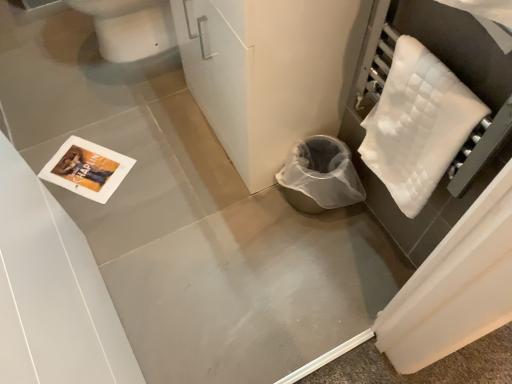
Question: From the image's perspective, is white glossy toilet bowl at upper left on top of white quilted towel at right?

Choices:
 (A) yes
 (B) no

Answer: (A)

Question: Does white glossy toilet bowl at upper left have a lesser height compared to white quilted towel at right?

Choices:
 (A) yes
 (B) no

Answer: (B)

Question: Can you confirm if white glossy toilet bowl at upper left is positioned to the left of white quilted towel at right?

Choices:
 (A) no
 (B) yes

Answer: (B)

Question: From a real-world perspective, is white glossy toilet bowl at upper left physically below white quilted towel at right?

Choices:
 (A) no
 (B) yes

Answer: (B)

Question: Is white glossy toilet bowl at upper left turned away from white quilted towel at right?

Choices:
 (A) no
 (B) yes

Answer: (A)

Question: Is white glossy toilet bowl at upper left outside of white quilted towel at right?

Choices:
 (A) yes
 (B) no

Answer: (A)

Question: Could you tell me if white quilted towel at right is facing white glossy toilet bowl at upper left?

Choices:
 (A) yes
 (B) no

Answer: (B)

Question: From the image's perspective, is white quilted towel at right on white glossy toilet bowl at upper left?

Choices:
 (A) no
 (B) yes

Answer: (A)

Question: Is white quilted towel at right facing away from white glossy toilet bowl at upper left?

Choices:
 (A) yes
 (B) no

Answer: (B)

Question: Can you confirm if white quilted towel at right is thinner than white glossy toilet bowl at upper left?

Choices:
 (A) yes
 (B) no

Answer: (A)

Question: From the image's perspective, is white quilted towel at right located beneath white glossy toilet bowl at upper left?

Choices:
 (A) yes
 (B) no

Answer: (A)

Question: Is white quilted towel at right located outside white glossy toilet bowl at upper left?

Choices:
 (A) no
 (B) yes

Answer: (B)

Question: Is white glossy toilet bowl at upper left in front of or behind white quilted towel at right in the image?

Choices:
 (A) front
 (B) behind

Answer: (B)